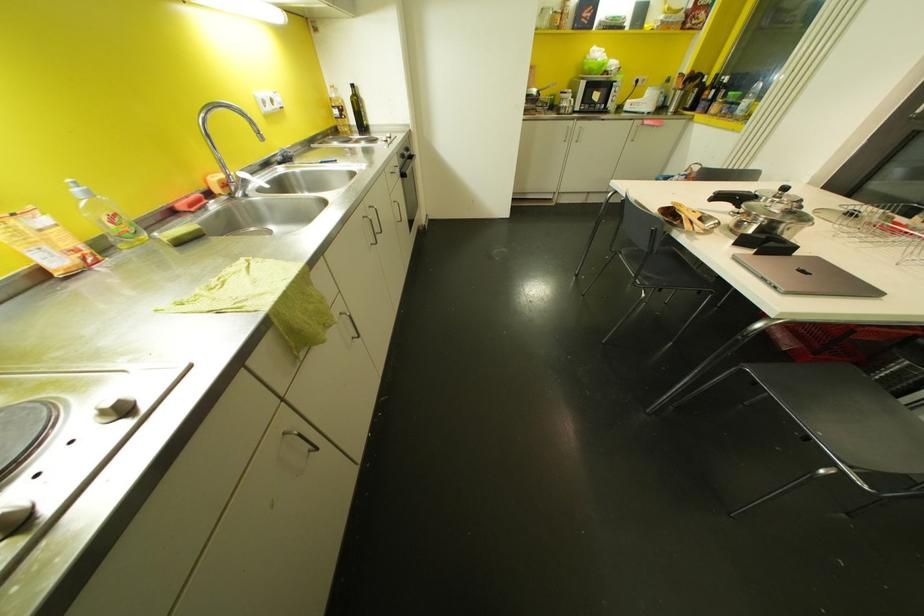
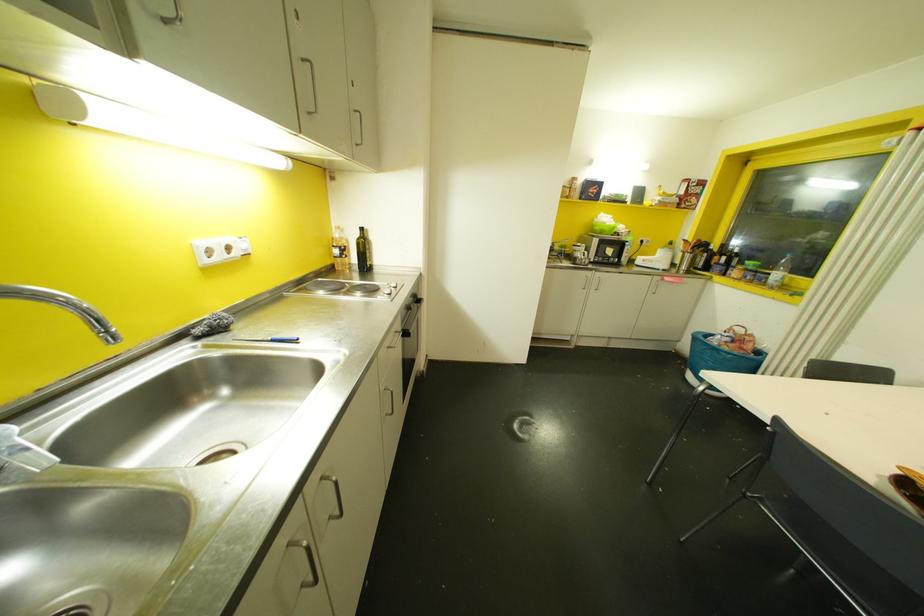
Question: How did the camera likely rotate?

Choices:
 (A) Left
 (B) Right
 (C) Up
 (D) Down

Answer: (C)